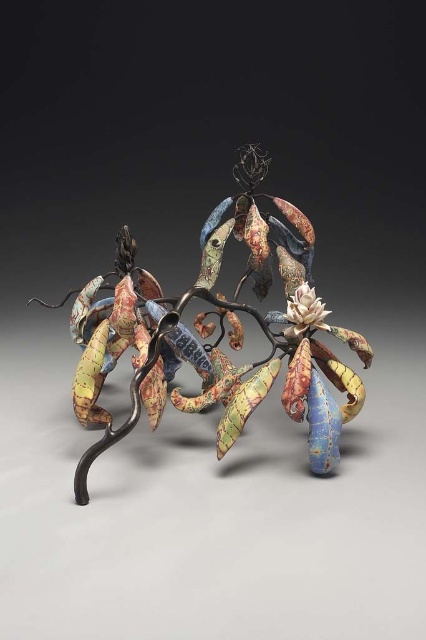
You are an art conservator examining the sculpture. You need to clean both the textured ceramic leaves at center and the white matte flower at center. Which object should you clean first if you want to start from the bottom?

The textured ceramic leaves at center should be cleaned first because it is positioned under the white matte flower at center, allowing you to work from the bottom upward without disturbing the upper elements.

You are an art curator examining the sculpture. You notice the textured ceramic leaves at center and the white matte flower at center. Which object is positioned closer to the front of the sculpture?

The textured ceramic leaves at center are closer to the viewer than the white matte flower at center, so they are positioned closer to the front of the sculpture.